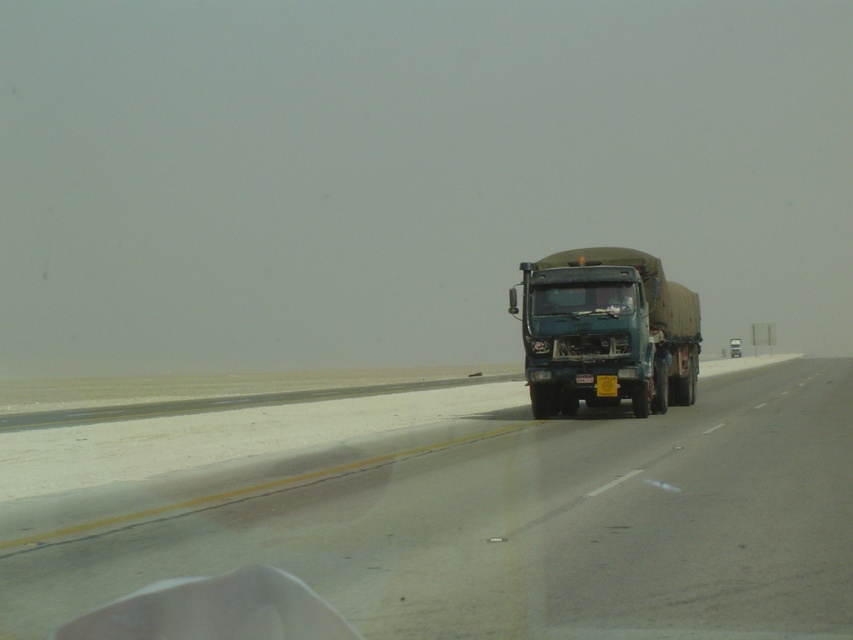
Which is behind, point (26, 541) or point (549, 308)?

Positioned behind is point (549, 308).

Between smooth asphalt highway at center and transparent glass windshield at center, which one appears on the left side from the viewer's perspective?

transparent glass windshield at center

Does point (67, 557) lie behind point (614, 307)?

No, (67, 557) is in front of (614, 307).

Find the location of a particular element. The height and width of the screenshot is (640, 853). smooth asphalt highway at center is located at coordinates (x=502, y=522).

Which is in front, point (654, 580) or point (643, 387)?

Point (654, 580) is more forward.

Which is above, smooth asphalt highway at center or green matte truck at center?

green matte truck at center is above.

Where is `smooth asphalt highway at center`? The height and width of the screenshot is (640, 853). smooth asphalt highway at center is located at coordinates (502, 522).

Where is `smooth asphalt highway at center`? Image resolution: width=853 pixels, height=640 pixels. smooth asphalt highway at center is located at coordinates (502, 522).

Does green matte truck at center have a larger size compared to transparent glass windshield at center?

Yes.

Locate an element on the screen. This screenshot has width=853, height=640. green matte truck at center is located at coordinates click(607, 332).

Locate an element on the screen. This screenshot has height=640, width=853. green matte truck at center is located at coordinates (607, 332).